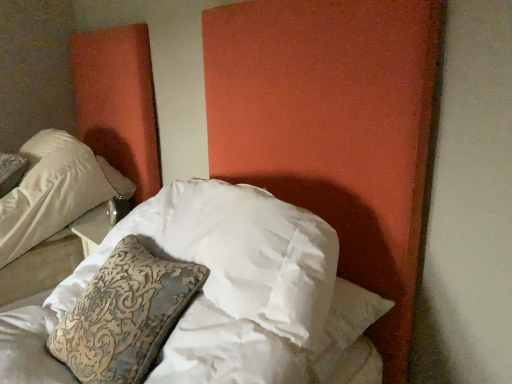
Locate an element on the screen. This screenshot has height=384, width=512. patterned fabric pillow at center is located at coordinates (125, 314).

What do you see at coordinates (125, 314) in the screenshot? This screenshot has height=384, width=512. I see `patterned fabric pillow at center` at bounding box center [125, 314].

Locate an element on the screen. This screenshot has height=384, width=512. patterned fabric pillow at center is located at coordinates (125, 314).